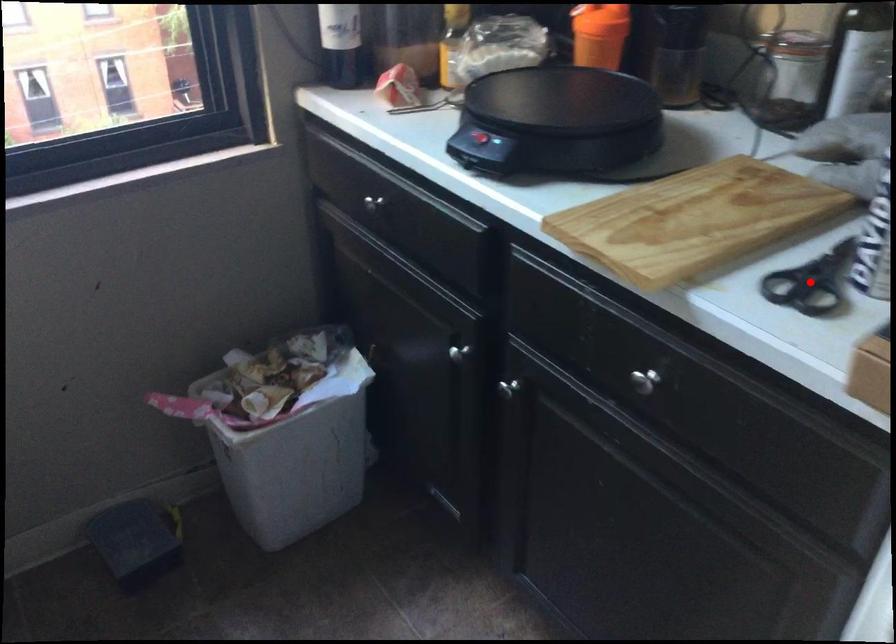
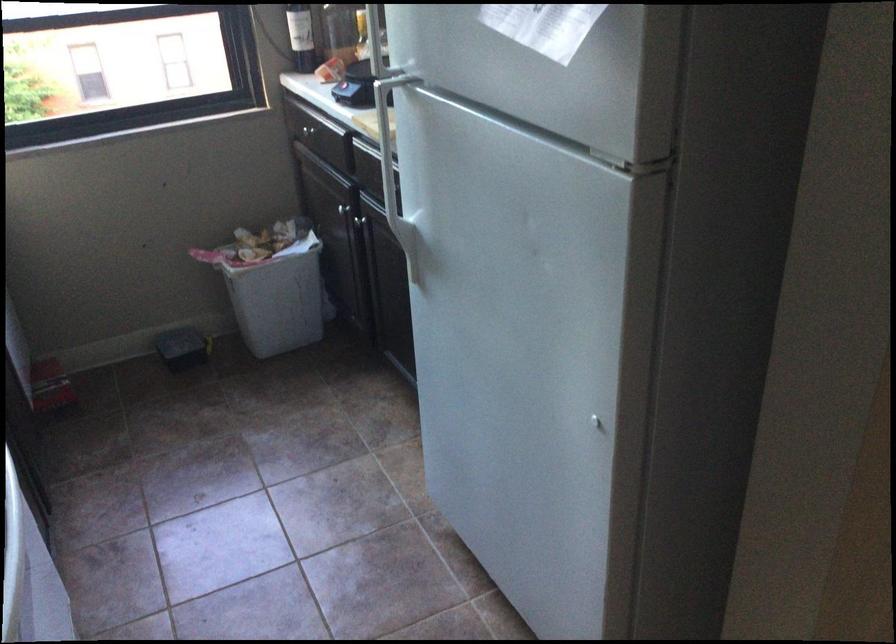
Question: I am providing you with two images of the same scene from different viewpoints. A red point is marked on the first image. At the location where the point appears in image 1, is it still visible in image 2?

Choices:
 (A) Yes
 (B) No

Answer: (B)